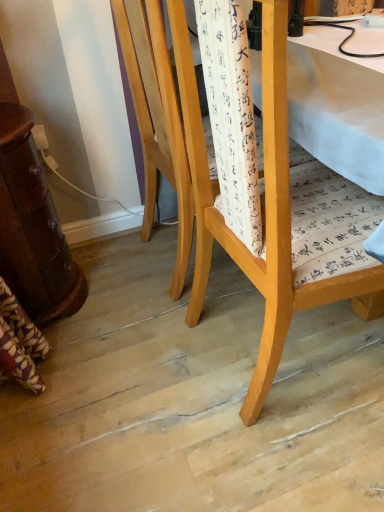
At what (x,y) coordinates should I click in order to perform the action: click on vacant point to the left of light wood chair at center, the 1th chair from the front. Please return your answer as a coordinate pair (x, y). Looking at the image, I should click on (168, 384).